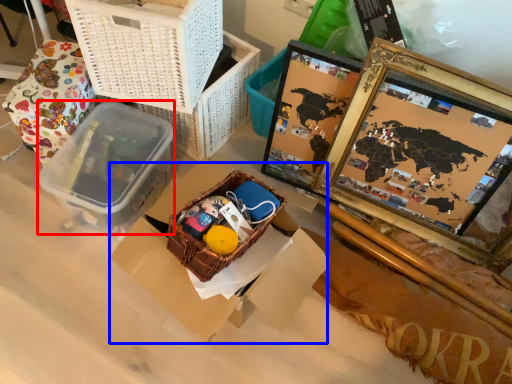
Question: Which object appears closest to the camera in this image, lunch box (highlighted by a red box) or cardboard box (highlighted by a blue box)?

Choices:
 (A) lunch box
 (B) cardboard box

Answer: (B)